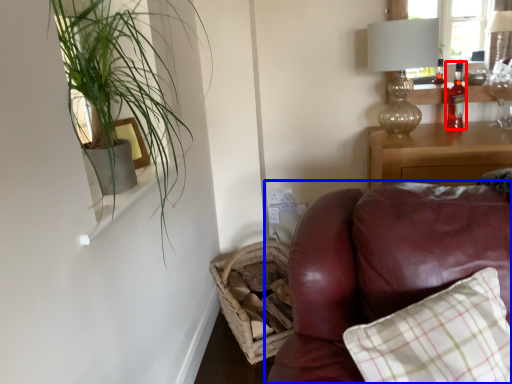
Question: Which object is further to the camera taking this photo, bottle (highlighted by a red box) or studio couch (highlighted by a blue box)?

Choices:
 (A) bottle
 (B) studio couch

Answer: (A)